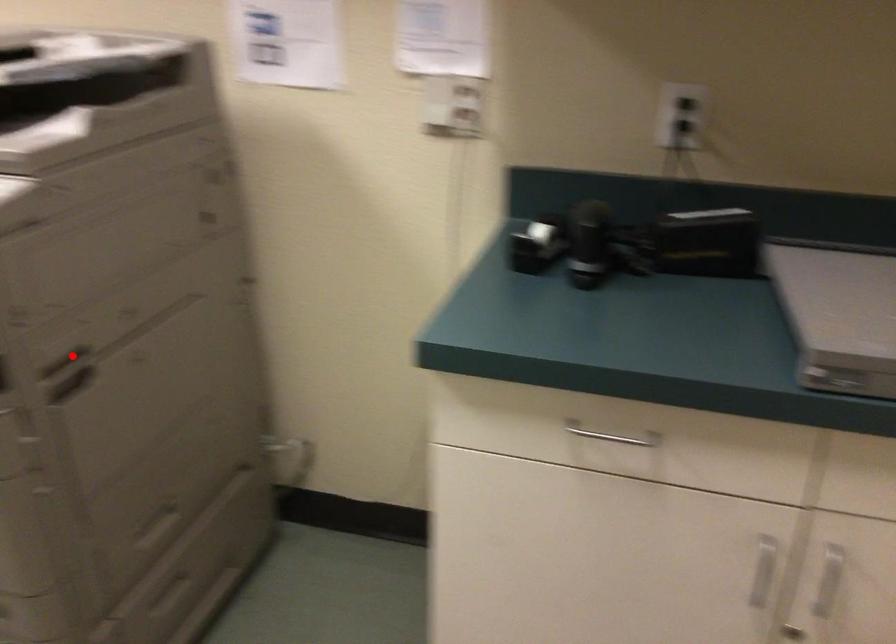
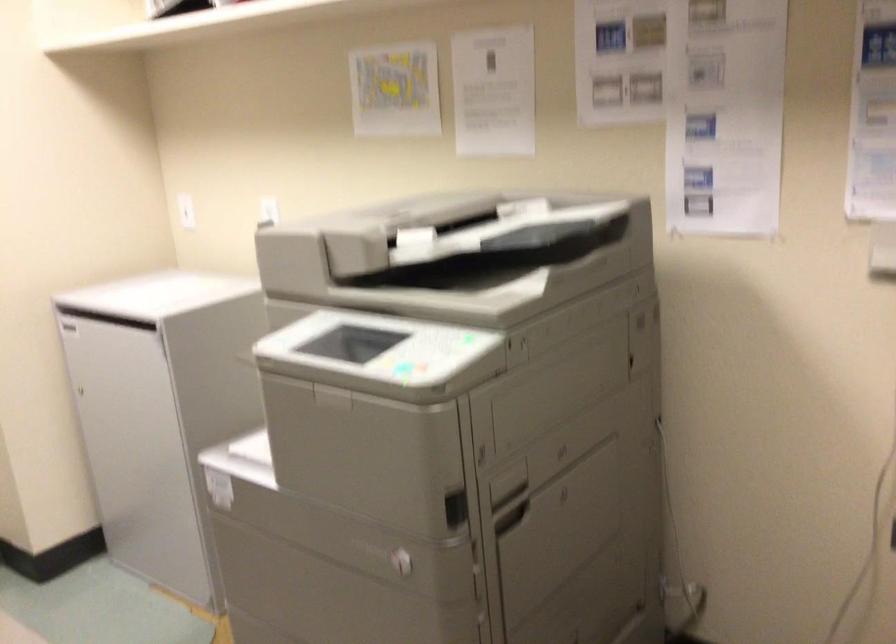
Find the pixel in the second image that matches the highlighted location in the first image.

(510, 495)